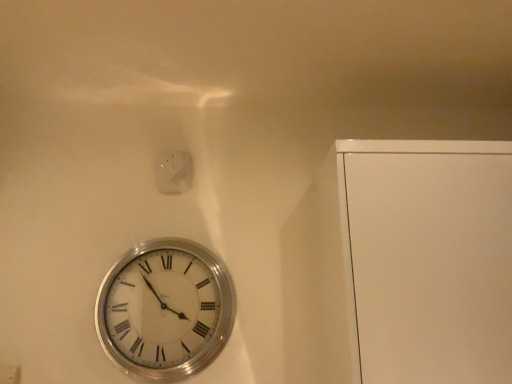
Find the location of a particular element. This screenshot has width=512, height=384. white glossy electric outlet at upper center is located at coordinates (174, 171).

What do you see at coordinates (174, 171) in the screenshot? The width and height of the screenshot is (512, 384). I see `white glossy electric outlet at upper center` at bounding box center [174, 171].

Image resolution: width=512 pixels, height=384 pixels. I want to click on silver metallic clock at lower left, so click(165, 310).

The image size is (512, 384). What do you see at coordinates (165, 310) in the screenshot?
I see `silver metallic clock at lower left` at bounding box center [165, 310].

The image size is (512, 384). I want to click on white glossy electric outlet at upper center, so 174,171.

Is white glossy electric outlet at upper center to the left or to the right of silver metallic clock at lower left in the image?

From the image, it's evident that white glossy electric outlet at upper center is to the left of silver metallic clock at lower left.

Is the depth of white glossy electric outlet at upper center greater than that of silver metallic clock at lower left?

That is True.

Considering the positions of points (178, 189) and (175, 302), is point (178, 189) closer to camera compared to point (175, 302)?

No.

From the image's perspective, between white glossy electric outlet at upper center and silver metallic clock at lower left, who is located below?

From the image's view, silver metallic clock at lower left is below.

From a real-world perspective, is white glossy electric outlet at upper center located higher than silver metallic clock at lower left?

Correct, in the physical world, white glossy electric outlet at upper center is higher than silver metallic clock at lower left.

Considering the sizes of objects white glossy electric outlet at upper center and silver metallic clock at lower left in the image provided, who is thinner, white glossy electric outlet at upper center or silver metallic clock at lower left?

white glossy electric outlet at upper center is thinner.

Does white glossy electric outlet at upper center have a lesser height compared to silver metallic clock at lower left?

Indeed, white glossy electric outlet at upper center has a lesser height compared to silver metallic clock at lower left.

Is white glossy electric outlet at upper center bigger than silver metallic clock at lower left?

No.

Can we say white glossy electric outlet at upper center lies outside silver metallic clock at lower left?

That's correct, white glossy electric outlet at upper center is outside of silver metallic clock at lower left.

Is the surface of white glossy electric outlet at upper center in direct contact with silver metallic clock at lower left?

There is a gap between white glossy electric outlet at upper center and silver metallic clock at lower left.

In the scene shown: Is white glossy electric outlet at upper center turned away from silver metallic clock at lower left?

That's not correct — white glossy electric outlet at upper center is not looking away from silver metallic clock at lower left.

Locate an element on the screen. The image size is (512, 384). electric outlet above the silver metallic clock at lower left (from the image's perspective) is located at coordinates (174, 171).

Visually, is silver metallic clock at lower left positioned to the left or to the right of white glossy electric outlet at upper center?

In the image, silver metallic clock at lower left appears on the right side of white glossy electric outlet at upper center.

Considering their positions, is silver metallic clock at lower left located in front of or behind white glossy electric outlet at upper center?

Visually, silver metallic clock at lower left is located in front of white glossy electric outlet at upper center.

Is point (162, 313) positioned in front of point (181, 186)?

Yes, it is.

From the image's perspective, is silver metallic clock at lower left located beneath white glossy electric outlet at upper center?

Yes.

From a real-world perspective, is silver metallic clock at lower left physically located above or below white glossy electric outlet at upper center?

silver metallic clock at lower left is below white glossy electric outlet at upper center.

Can you confirm if silver metallic clock at lower left is wider than white glossy electric outlet at upper center?

Yes.

Considering the relative sizes of silver metallic clock at lower left and white glossy electric outlet at upper center in the image provided, is silver metallic clock at lower left taller than white glossy electric outlet at upper center?

Yes, silver metallic clock at lower left is taller than white glossy electric outlet at upper center.

Which of these two, silver metallic clock at lower left or white glossy electric outlet at upper center, is bigger?

silver metallic clock at lower left.

Choose the correct answer: Is silver metallic clock at lower left inside white glossy electric outlet at upper center or outside it?

silver metallic clock at lower left exists outside the volume of white glossy electric outlet at upper center.

Does silver metallic clock at lower left touch white glossy electric outlet at upper center?

No, silver metallic clock at lower left is not next to white glossy electric outlet at upper center.

Is silver metallic clock at lower left facing towards white glossy electric outlet at upper center?

No, silver metallic clock at lower left does not turn towards white glossy electric outlet at upper center.

Identify the location of wall clock below the white glossy electric outlet at upper center (from the image's perspective). click(x=165, y=310).

At what (x,y) coordinates should I click in order to perform the action: click on electric outlet lying behind the silver metallic clock at lower left. Please return your answer as a coordinate pair (x, y). This screenshot has width=512, height=384. Looking at the image, I should click on click(x=174, y=171).

Identify the location of wall clock below the white glossy electric outlet at upper center (from the image's perspective). (165, 310).